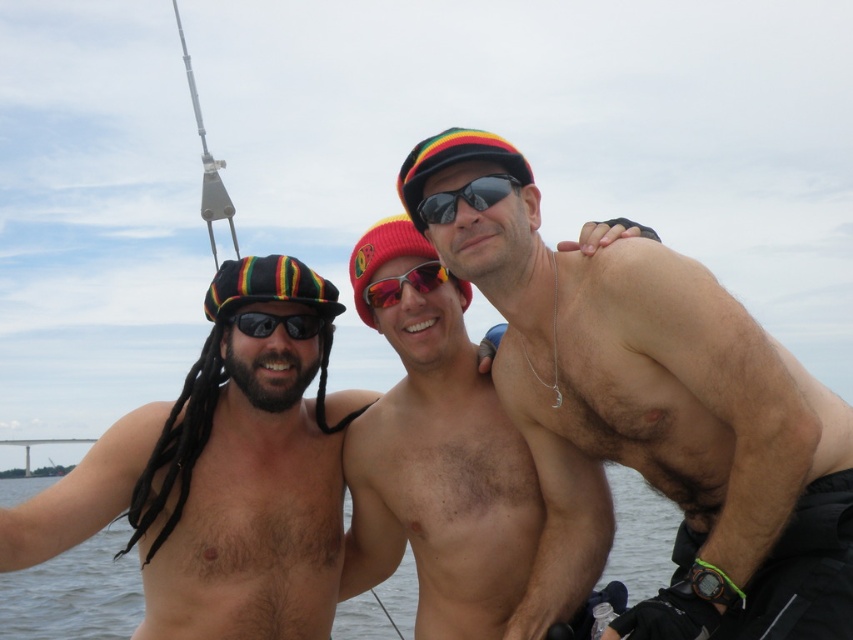
You are navigating a small drone that needs to fly from point A to point B. The points are labeled as point (412,196) and point (495,188). Which point should you start at to ensure the drone flies over the man in the middle?

Point (495,188) should be the starting point because point (412,196) is behind it, so starting at point (495,188) will allow the drone to fly over the man in the middle first before reaching the point behind.

You are a photographer trying to capture a group photo of the three men. You notice the red knit beanie at center and the metallic silver fishing pole at upper left. Which object should you position closer to the left side of the frame to ensure both are visible?

The metallic silver fishing pole at upper left should be positioned closer to the left side of the frame since it is already to the left of the red knit beanie at center, allowing both to fit within the frame.